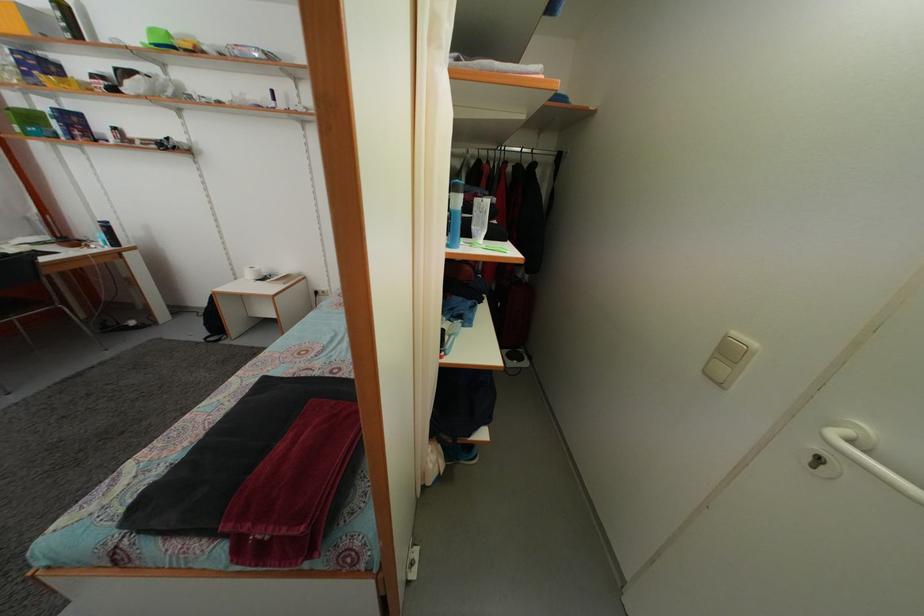
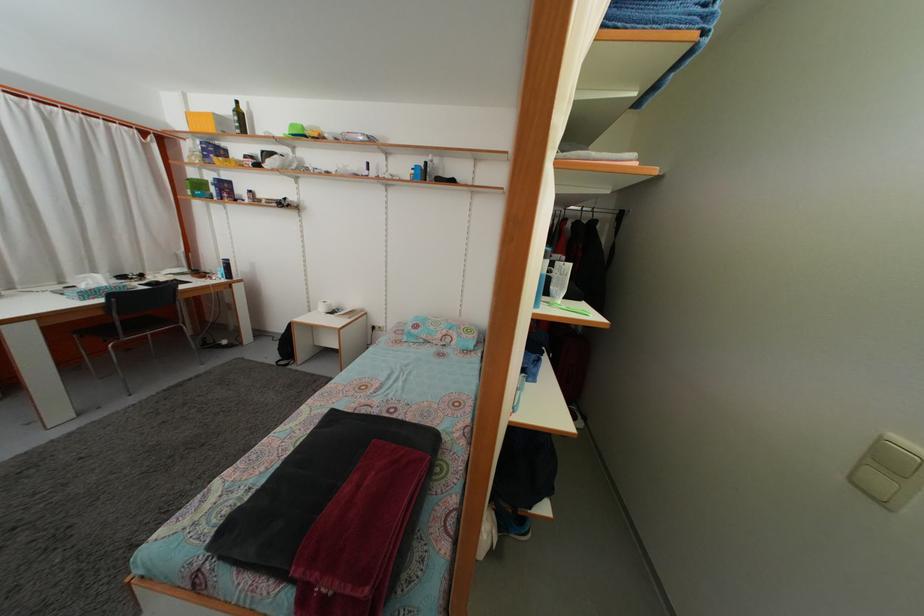
Locate, in the second image, the point that corresponds to pixel 740 341 in the first image.

(903, 445)